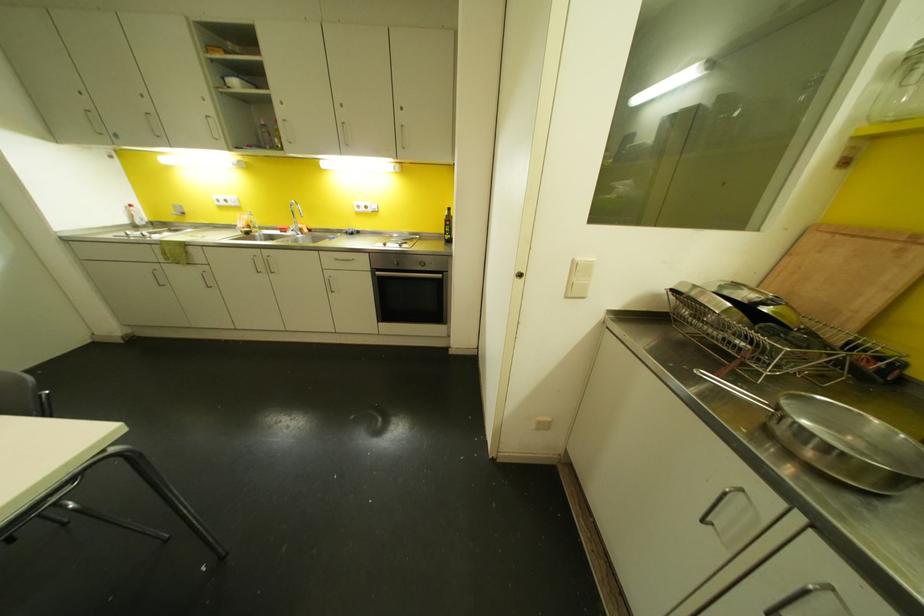
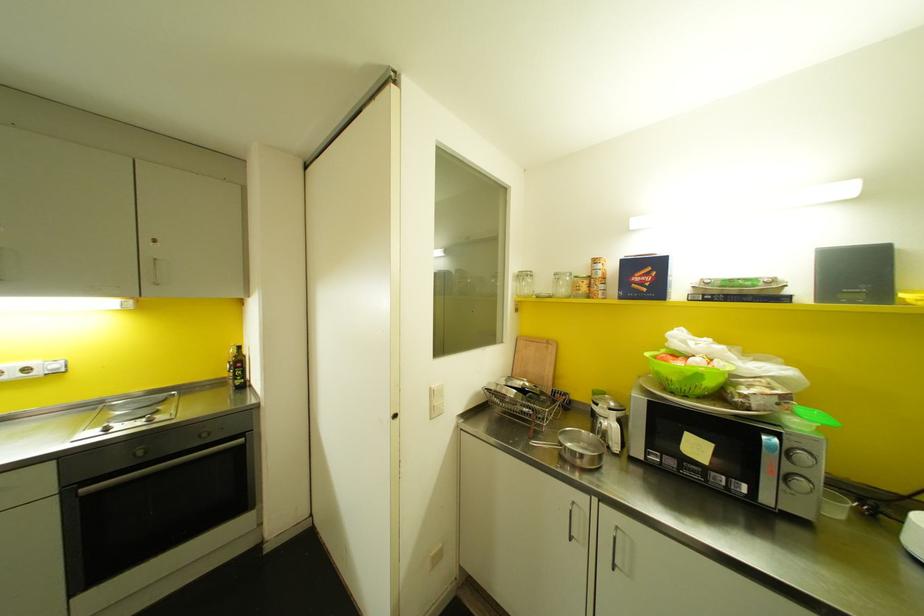
In the second image, find the point that corresponds to (x=782, y=431) in the first image.

(566, 456)